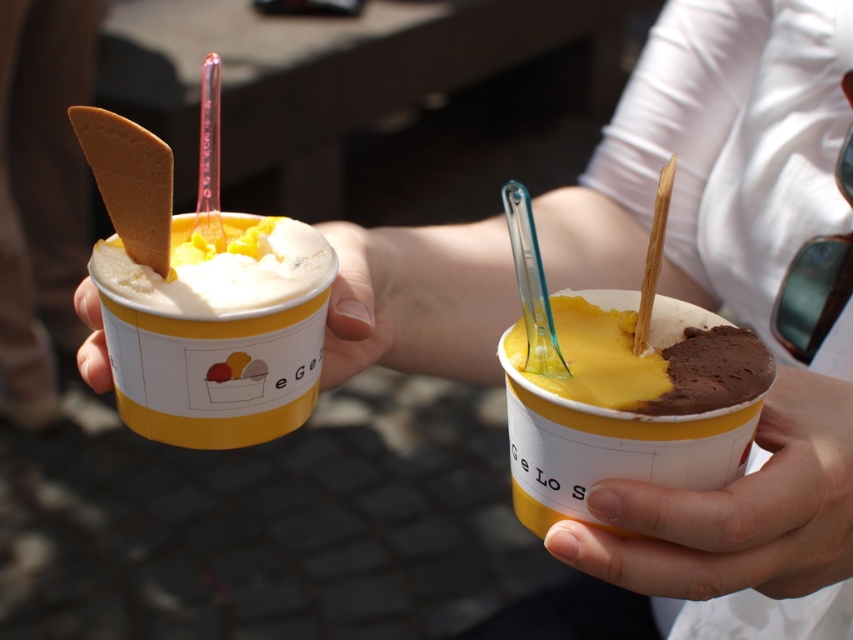
Question: Which is farther from the yellow creamy ice cream at center?

Choices:
 (A) yellow matte ice cream cup at left
 (B) smooth yellow ice cream cup at center
 (C) smooth skin hand at lower right

Answer: (B)

Question: Can you confirm if smooth skin hand at lower right is thinner than yellow creamy ice cream at center?

Choices:
 (A) no
 (B) yes

Answer: (A)

Question: Is smooth skin hand at lower right positioned in front of yellow creamy ice cream at center?

Choices:
 (A) yes
 (B) no

Answer: (A)

Question: Which point is farther to the camera?

Choices:
 (A) (697, 340)
 (B) (657, 493)
 (C) (723, 525)
 (D) (126, 387)

Answer: (D)

Question: Observing the image, what is the correct spatial positioning of yellow matte ice cream cup at left in reference to yellow creamy ice cream at center?

Choices:
 (A) right
 (B) left

Answer: (B)

Question: Which point is farther to the camera?

Choices:
 (A) (788, 509)
 (B) (614, 570)
 (C) (114, 307)

Answer: (C)